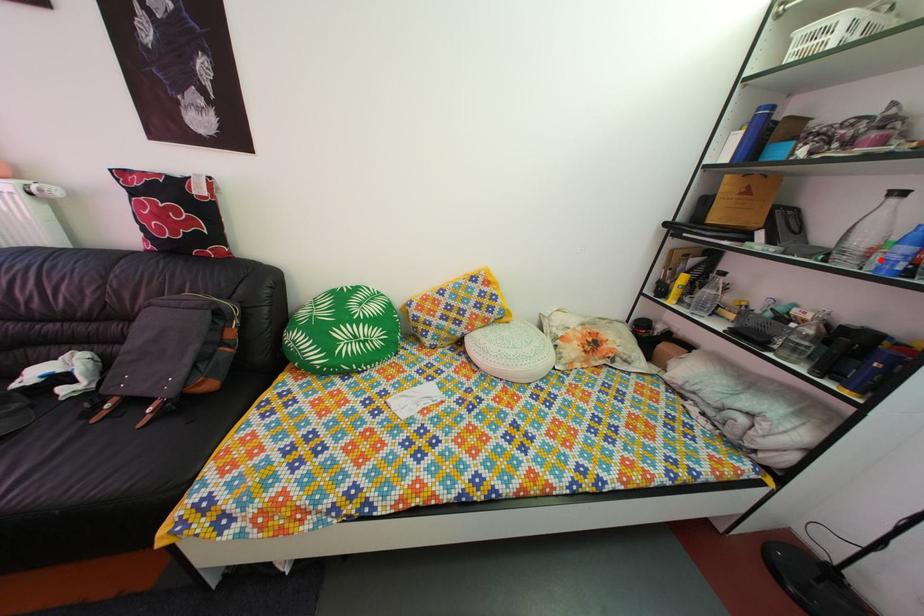
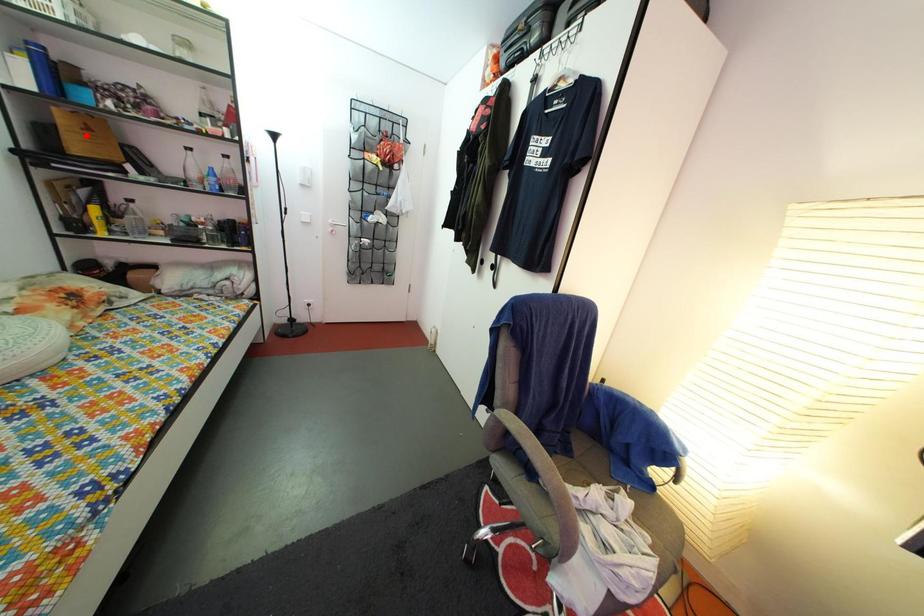
I am providing you with two images of the same scene from different viewpoints. A red point is marked on the first image and another point is marked on the second image. Is the red point in image1 aligned with the point shown in image2?

No